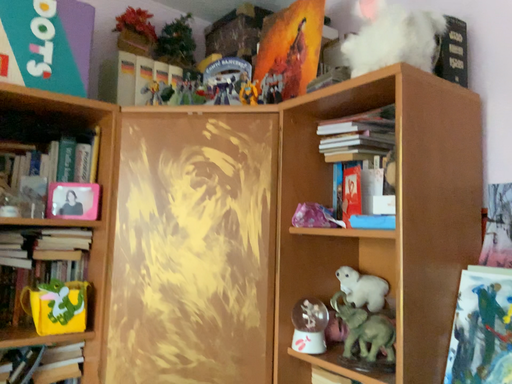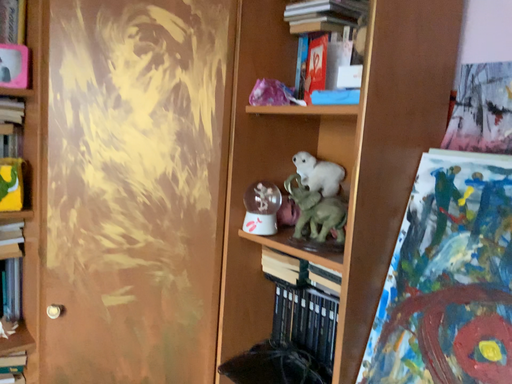
Question: Which way did the camera rotate in the video?

Choices:
 (A) rotated upward
 (B) rotated downward

Answer: (B)